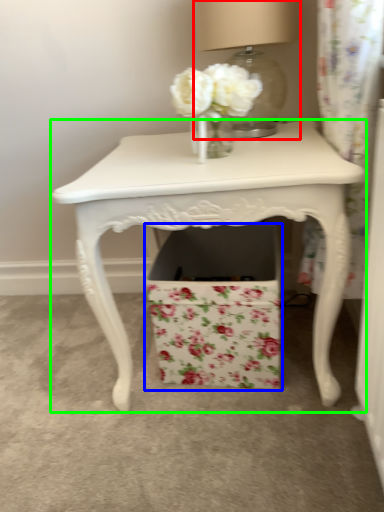
Question: Which object is positioned closest to table lamp (highlighted by a red box)? Select from cardboard box (highlighted by a blue box) and table (highlighted by a green box).

Choices:
 (A) cardboard box
 (B) table

Answer: (B)